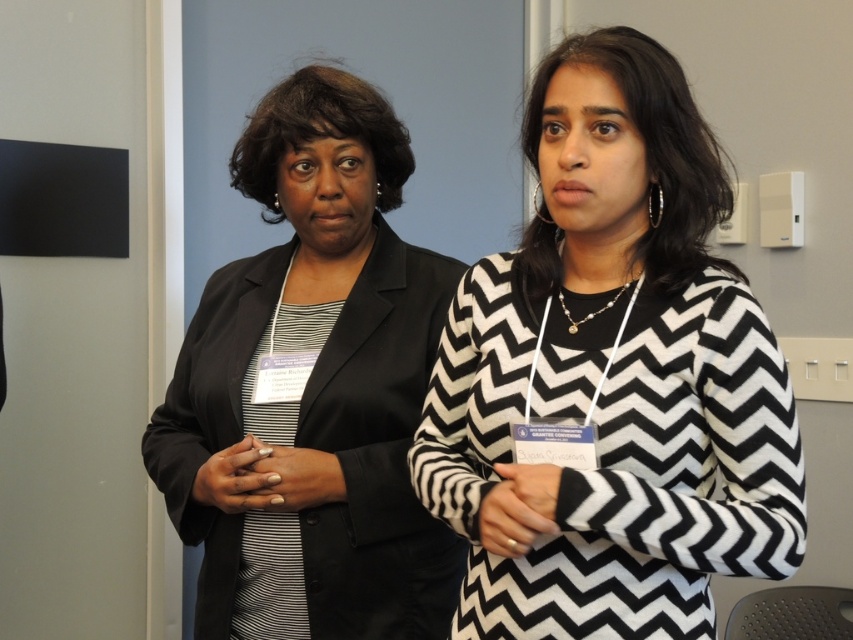
Can you confirm if black and white zigzag sweater at center is positioned below black satin blazer at left?

Incorrect, black and white zigzag sweater at center is not positioned below black satin blazer at left.

Can you confirm if black and white zigzag sweater at center is taller than black satin blazer at left?

No.

Between point (489, 435) and point (389, 554), which one is positioned in front?

Point (489, 435) is more forward.

Image resolution: width=853 pixels, height=640 pixels. Find the location of `black and white zigzag sweater at center`. black and white zigzag sweater at center is located at coordinates (612, 376).